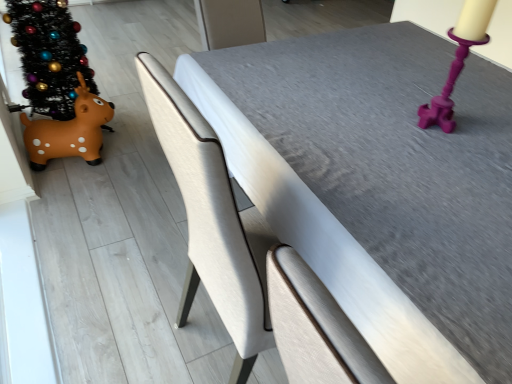
Identify the location of free location to the right of brown rubber toy at left. (132, 169).